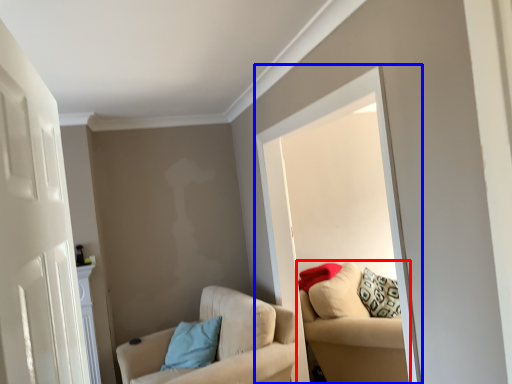
Question: Which object appears closest to the camera in this image, studio couch (highlighted by a red box) or window (highlighted by a blue box)?

Choices:
 (A) studio couch
 (B) window

Answer: (B)